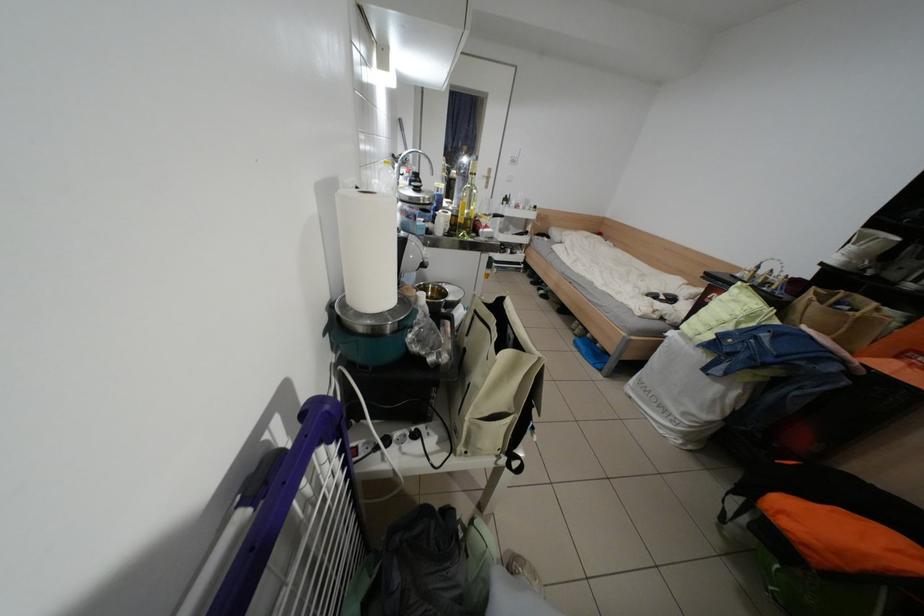
Find the location of `pot lid handle`. pot lid handle is located at coordinates (423, 212).